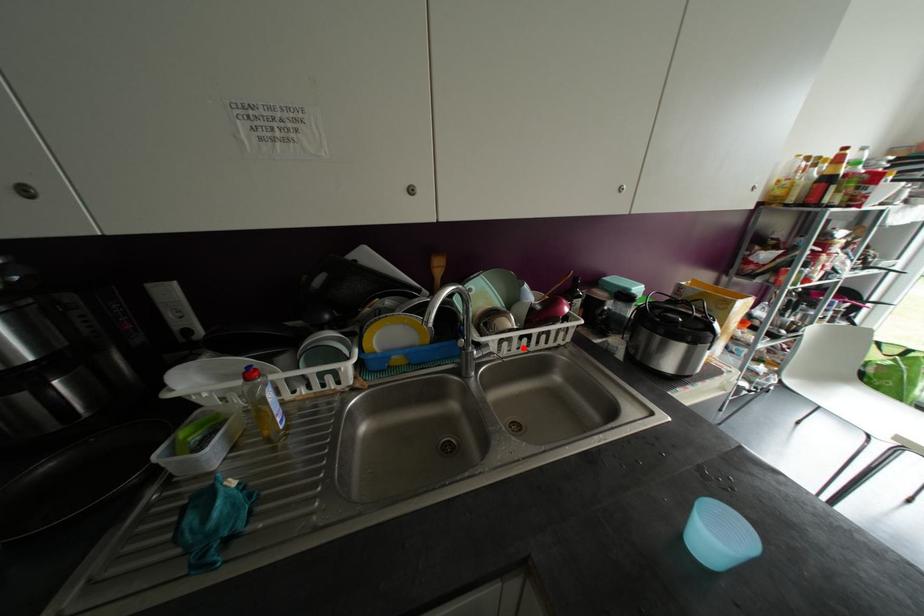
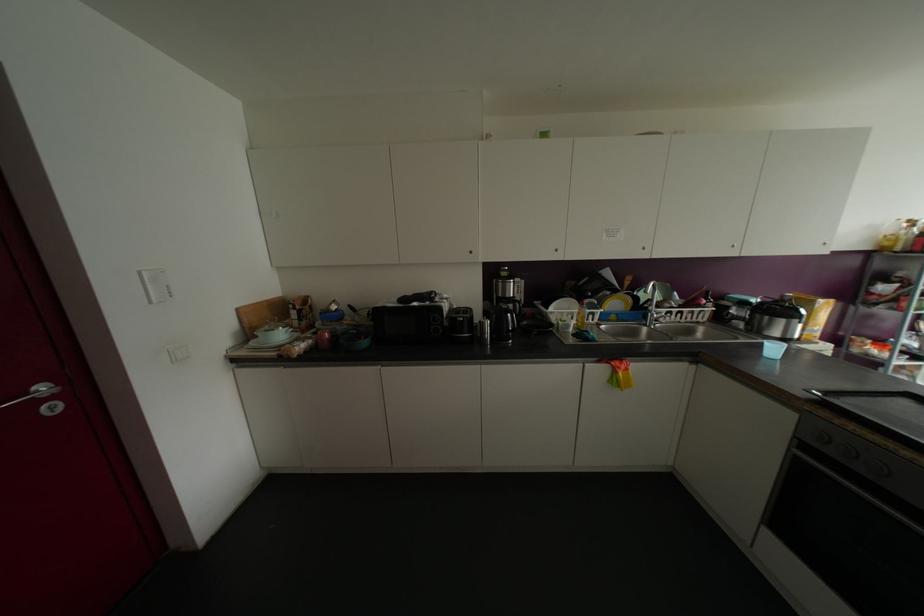
The point at the highlighted location is marked in the first image. Where is the corresponding point in the second image?

(677, 318)